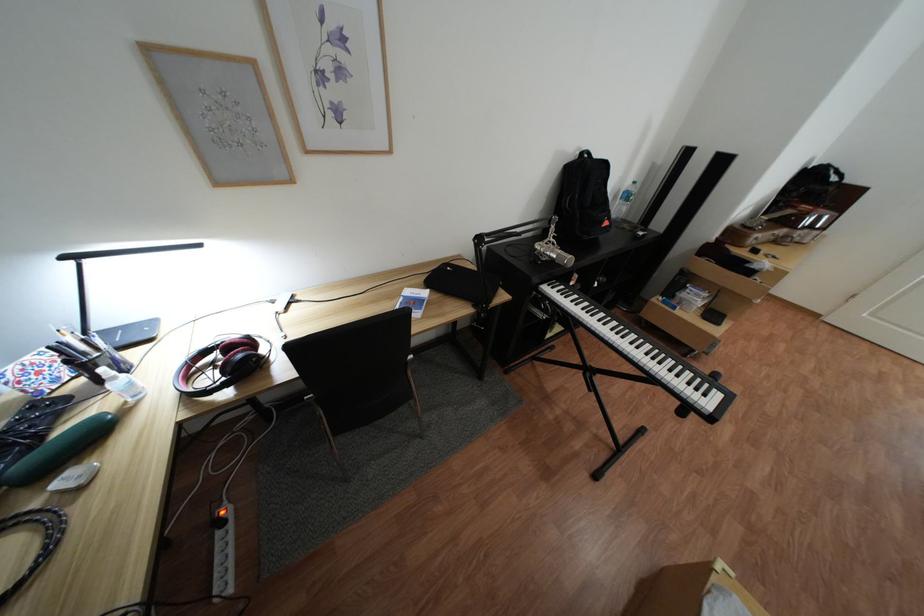
The width and height of the screenshot is (924, 616). Describe the element at coordinates (122, 384) in the screenshot. I see `a small white bottle` at that location.